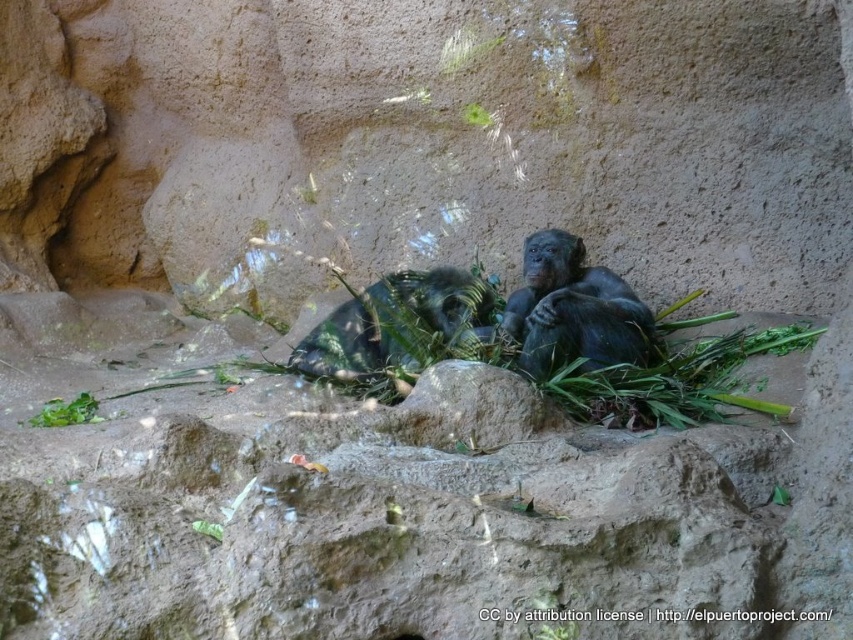
Question: Does green leafy plant at center appear on the left side of green leafy plant at lower left?

Choices:
 (A) no
 (B) yes

Answer: (A)

Question: Considering the relative positions of green leafy plant at lower left and green leafy plant at upper center in the image provided, where is green leafy plant at lower left located with respect to green leafy plant at upper center?

Choices:
 (A) above
 (B) below

Answer: (B)

Question: Which object is the closest to the green leafy plant at lower center?

Choices:
 (A) green leafy plant at lower left
 (B) shiny black ape at center
 (C) green leafy plant at upper center
 (D) green leafy plant at center

Answer: (A)

Question: Is green leafy plant at upper center to the right of green leafy plant at lower center from the viewer's perspective?

Choices:
 (A) yes
 (B) no

Answer: (A)

Question: Which object appears farthest from the camera in this image?

Choices:
 (A) green leafy plant at upper center
 (B) green leafy plant at center
 (C) green leafy plant at lower left

Answer: (A)

Question: Which of these objects is positioned closest to the shiny black ape at center?

Choices:
 (A) green leafy plant at lower center
 (B) green leafy plant at lower left
 (C) green leafy plant at center

Answer: (C)